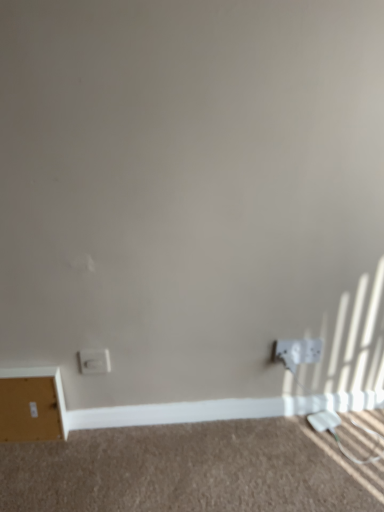
Question: Is white plastic power plugs and sockets at lower right, acting as the 2th power plugs and sockets starting from the left, positioned before white matte baseboard at lower center?

Choices:
 (A) no
 (B) yes

Answer: (B)

Question: Considering the relative sizes of white plastic power plugs and sockets at lower right, acting as the 2th power plugs and sockets starting from the left, and white matte baseboard at lower center in the image provided, is white plastic power plugs and sockets at lower right, acting as the 2th power plugs and sockets starting from the left, bigger than white matte baseboard at lower center?

Choices:
 (A) no
 (B) yes

Answer: (A)

Question: Does white plastic power plugs and sockets at lower right, which ranks as the first power plugs and sockets in right-to-left order, have a lesser width compared to white matte baseboard at lower center?

Choices:
 (A) yes
 (B) no

Answer: (A)

Question: Is white plastic power plugs and sockets at lower right, acting as the 2th power plugs and sockets starting from the left, turned away from white matte baseboard at lower center?

Choices:
 (A) no
 (B) yes

Answer: (A)

Question: Can you confirm if white plastic power plugs and sockets at lower right, acting as the 2th power plugs and sockets starting from the left, is positioned to the left of white matte baseboard at lower center?

Choices:
 (A) no
 (B) yes

Answer: (A)

Question: From a real-world perspective, is white plastic power plugs and sockets at lower right, acting as the 2th power plugs and sockets starting from the left, below white matte baseboard at lower center?

Choices:
 (A) yes
 (B) no

Answer: (B)

Question: Can you confirm if white matte file cabinet at lower left is shorter than white plastic power outlet at lower right?

Choices:
 (A) yes
 (B) no

Answer: (B)

Question: Is white matte file cabinet at lower left at the left side of white plastic power outlet at lower right?

Choices:
 (A) yes
 (B) no

Answer: (A)

Question: Considering the relative sizes of white matte file cabinet at lower left and white plastic power outlet at lower right in the image provided, is white matte file cabinet at lower left smaller than white plastic power outlet at lower right?

Choices:
 (A) no
 (B) yes

Answer: (A)

Question: Is white matte file cabinet at lower left completely or partially outside of white plastic power outlet at lower right?

Choices:
 (A) yes
 (B) no

Answer: (A)

Question: Is white matte file cabinet at lower left in front of white plastic power outlet at lower right?

Choices:
 (A) no
 (B) yes

Answer: (B)

Question: Does white matte file cabinet at lower left have a larger size compared to white plastic power outlet at lower right?

Choices:
 (A) yes
 (B) no

Answer: (A)

Question: Can you confirm if white plastic socket at lower left, which ranks as the 1th power plugs and sockets in left-to-right order, is shorter than white plastic power outlet at lower right?

Choices:
 (A) yes
 (B) no

Answer: (B)